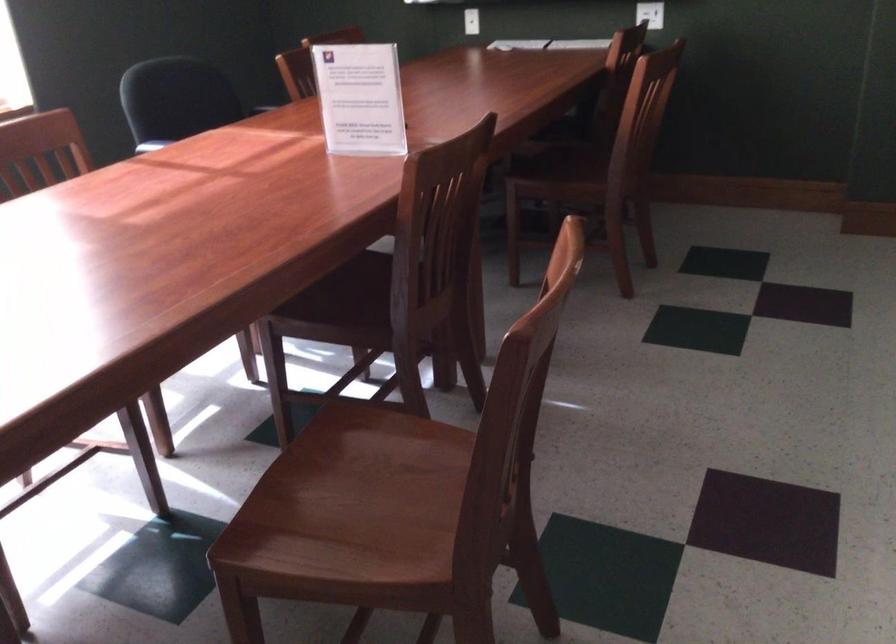
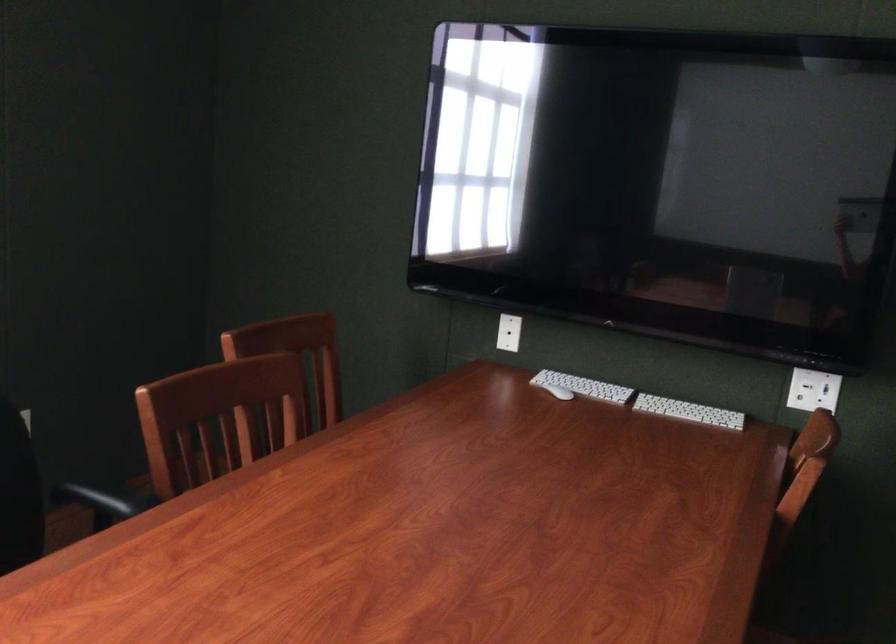
Question: The images are taken continuously from a first-person perspective. In which direction are you moving?

Choices:
 (A) Left
 (B) Right
 (C) Forward
 (D) Backward

Answer: (C)